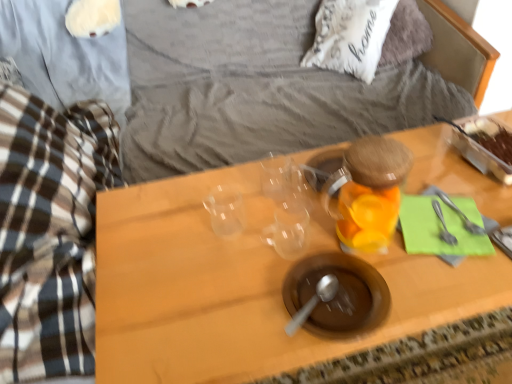
The height and width of the screenshot is (384, 512). In order to click on unoccupied region to the right of brown matte bowl at center in this screenshot , I will do `click(413, 287)`.